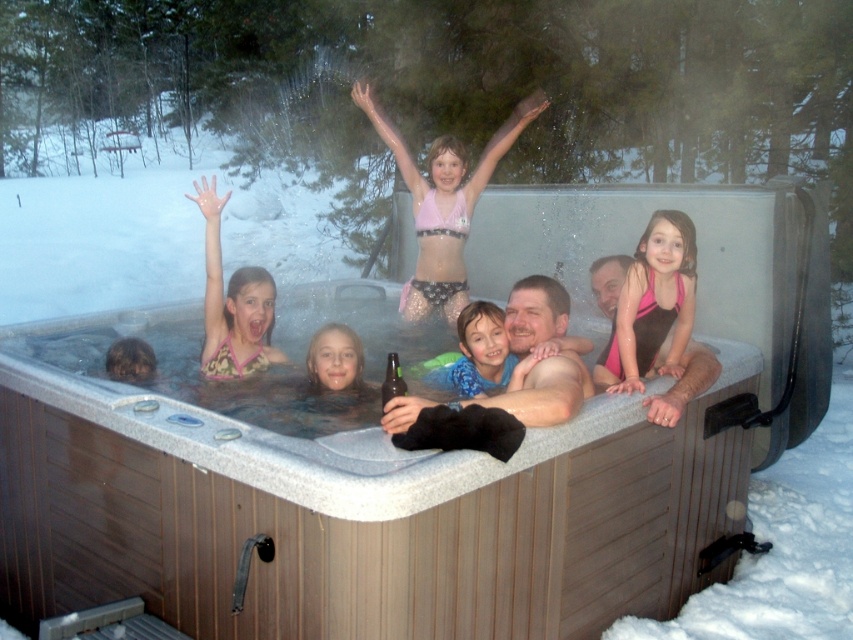
Question: Which of the following is the closest to the observer?

Choices:
 (A) blue patterned shirt at center
 (B) pink fabric swimsuit at center
 (C) wooden hot tub at center

Answer: (C)

Question: Estimate the real-world distances between objects in this image. Which object is closer to the smooth skin face at center?

Choices:
 (A) pink swimsuit at upper right
 (B) wooden hot tub at center

Answer: (B)

Question: Is wooden hot tub at center thinner than pink fabric swimsuit at center?

Choices:
 (A) yes
 (B) no

Answer: (B)

Question: Does wooden hot tub at center appear on the right side of green glass bottle at center?

Choices:
 (A) no
 (B) yes

Answer: (B)

Question: Does wooden hot tub at center have a larger size compared to green glass bottle at center?

Choices:
 (A) yes
 (B) no

Answer: (A)

Question: Estimate the real-world distances between objects in this image. Which object is closer to the pink swimsuit at upper right?

Choices:
 (A) green glass bottle at center
 (B) pink fabric swimsuit at center
 (C) pink fabric bikini at upper center

Answer: (A)